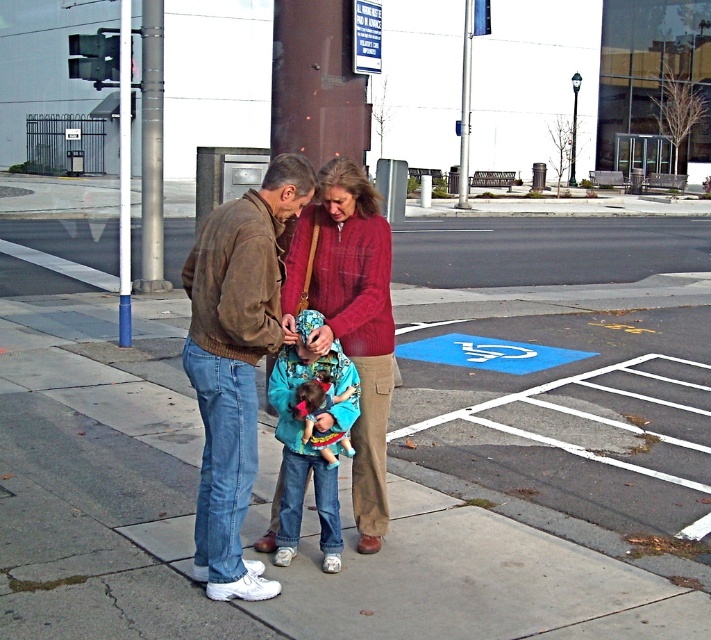
What object is located at the coordinates point (151, 150)?

The silver metallic pole at upper left is located at point (151, 150).

Consider the image. You are a delivery person with a cart that is 3 meters wide. You need to move through the space between the concrete sidewalk at center and the brown suede jacket at center. Can your cart fit through this space?

The space between the concrete sidewalk at center and the brown suede jacket at center is 2.91 meters. Since your cart is 3 meters wide, it cannot fit through the space as it is slightly narrower than the cart.

You are a city planner analyzing the street layout. You notice the silver metallic pole at upper left and the brushed metal pole at center. Which pole takes up more visual space in the image?

The brushed metal pole at center occupies more visual space than the silver metallic pole at upper left.